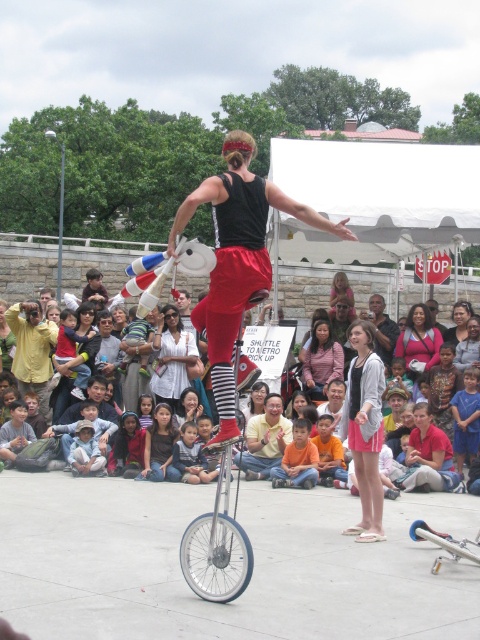
You are a photographer trying to capture the performer and the audience in the same frame. Given that the matte black unicycle at center is taller than the yellow shirt at center, which object should you focus on first to ensure both the performer and the audience are visible?

The matte black unicycle at center is taller than the yellow shirt at center. To ensure both the performer and the audience are visible, focus on the matte black unicycle at center first, as its height will help frame the scene with the performer in the foreground and the audience in the background.

You are a photographer at the event and want to capture both the white shirt at center and the yellow shirt at center in your photo. Which shirt should you focus on to ensure both are in the frame?

The white shirt at center is larger than the yellow shirt at center, so focusing on the white shirt at center will help ensure both are in the frame.

You are a photographer trying to capture the performer in the center of the image. You notice two shirts at the center, a white shirt at center and a yellow shirt at center. Which shirt is more visible in the photo?

The white shirt at center is more visible because it is positioned over the yellow shirt at center, making it appear in front.